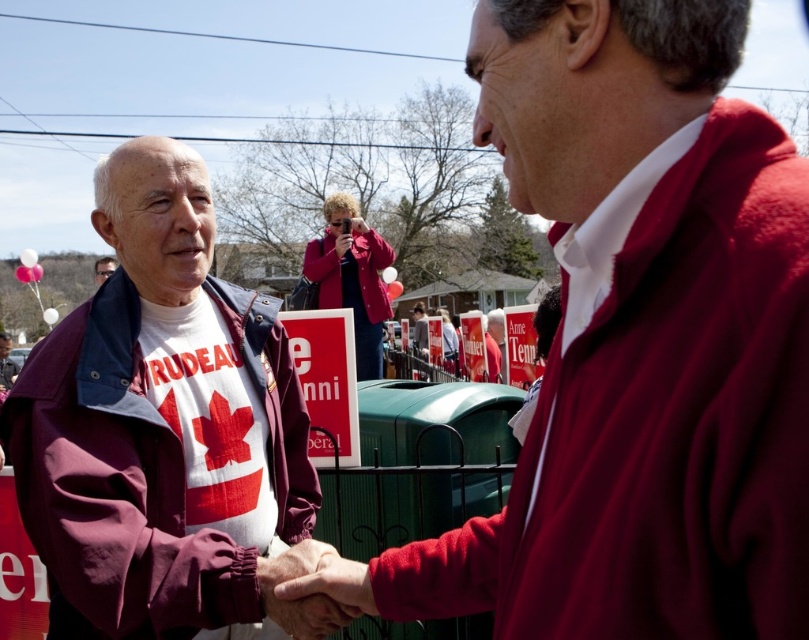
Between maroon fleece jacket at center and smooth leather hand at center, which one has more height?

Standing taller between the two is maroon fleece jacket at center.

Who is positioned more to the right, maroon fleece jacket at center or smooth leather hand at center?

maroon fleece jacket at center is more to the right.

The height and width of the screenshot is (640, 809). I want to click on maroon fleece jacket at center, so click(637, 342).

Between maroon fabric santa claus at left and matte maroon jacket at center, which one appears on the right side from the viewer's perspective?

maroon fabric santa claus at left is more to the right.

Can you confirm if maroon fabric santa claus at left is smaller than matte maroon jacket at center?

Correct, maroon fabric santa claus at left occupies less space than matte maroon jacket at center.

Locate an element on the screen. maroon fabric santa claus at left is located at coordinates (166, 433).

Does maroon fleece jacket at center have a smaller size compared to pink fabric camera at center?

Yes.

Between maroon fleece jacket at center and pink fabric camera at center, which one is positioned higher?

Positioned higher is pink fabric camera at center.

Who is more distant from viewer, (523, 525) or (311, 266)?

Point (311, 266)

Find the location of a particular element. The width and height of the screenshot is (809, 640). maroon fleece jacket at center is located at coordinates (637, 342).